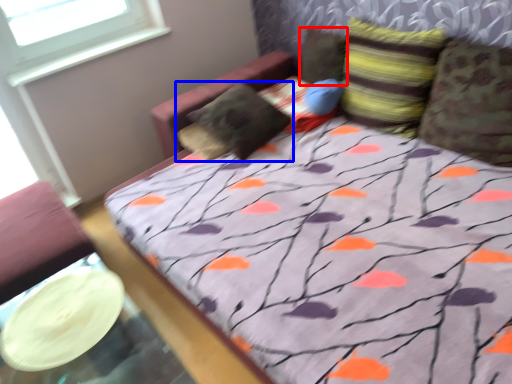
Question: Which point is closer to the camera, pillow (highlighted by a red box) or pillow (highlighted by a blue box)?

Choices:
 (A) pillow
 (B) pillow

Answer: (B)